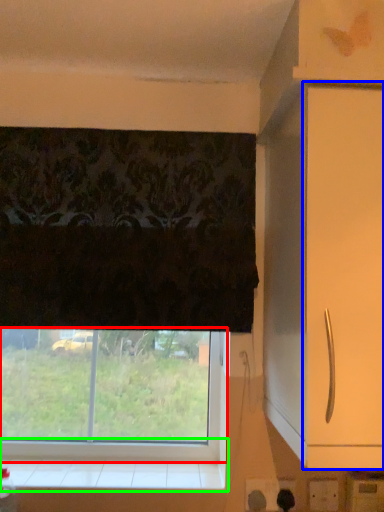
Question: Which object is positioned closest to window (highlighted by a red box)? Select from screen door (highlighted by a blue box) and window sill (highlighted by a green box).

Choices:
 (A) screen door
 (B) window sill

Answer: (B)